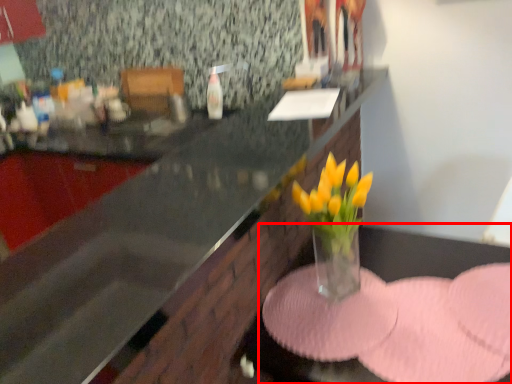
Question: From the image's perspective, what is the correct spatial positioning of table (annotated by the red box) in reference to countertop?

Choices:
 (A) below
 (B) above

Answer: (A)